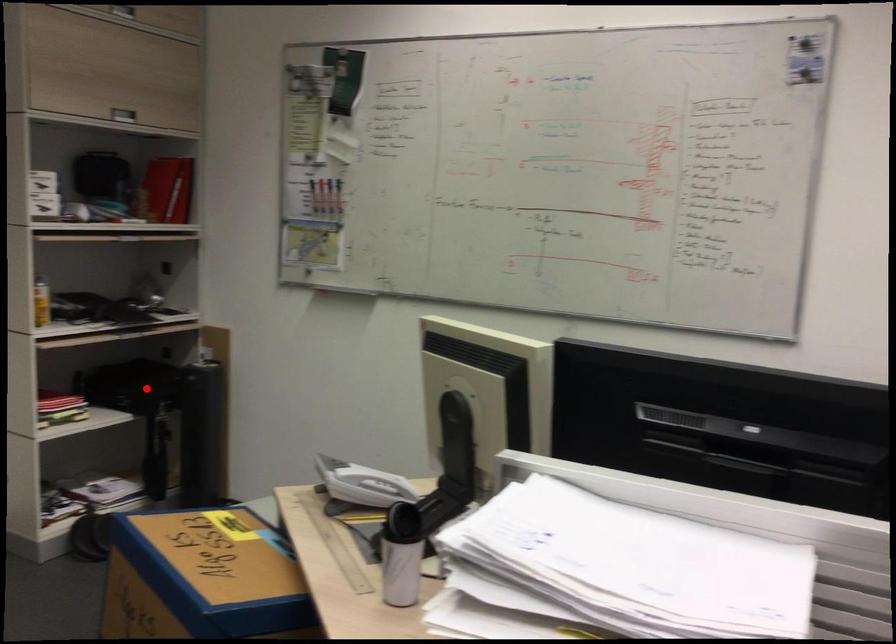
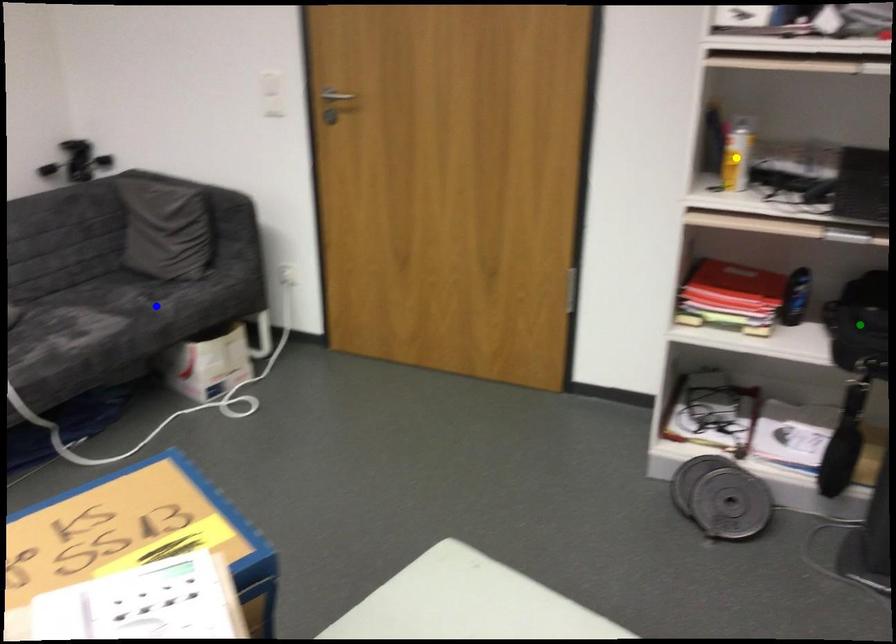
Question: I am providing you with two images of the same scene from different viewpoints. A red point is marked on the first image. You are given multiple points on the second image. Which point in image 2 is actually the same real-world point as the red point in image 1?

Choices:
 (A) green point
 (B) blue point
 (C) yellow point

Answer: (A)